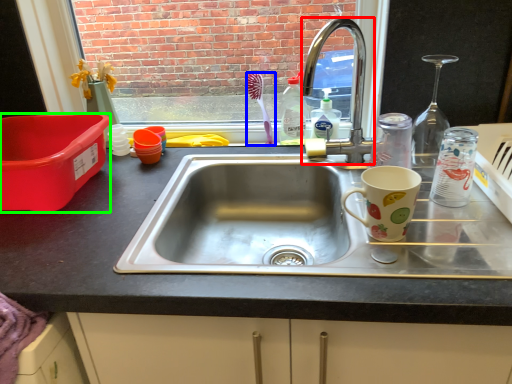
Question: Which object is the farthest from faucet (highlighted by a red box)? Choose among these: toothbrush (highlighted by a blue box) or box (highlighted by a green box).

Choices:
 (A) toothbrush
 (B) box

Answer: (B)